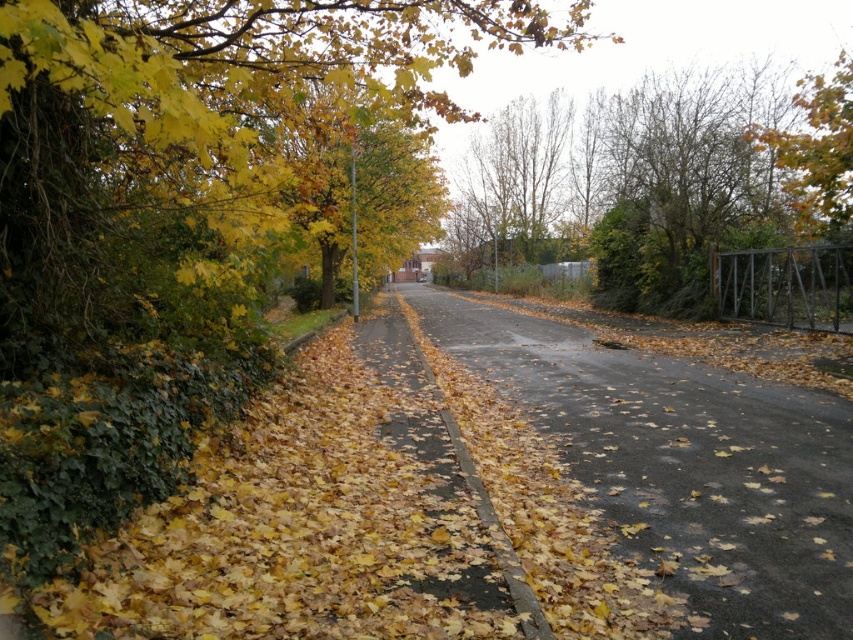
Question: Estimate the real-world distances between objects in this image. Which object is closer to the green leafy tree at upper right?

Choices:
 (A) brown asphalt road at center
 (B) green leafy tree at left

Answer: (B)

Question: Which object is the closest to the green leafy tree at upper right?

Choices:
 (A) brown asphalt road at center
 (B) green leafy tree at left

Answer: (B)

Question: Which point appears closest to the camera in this image?

Choices:
 (A) (685, 202)
 (B) (532, 401)
 (C) (19, 285)

Answer: (C)

Question: Is the position of brown asphalt road at center more distant than that of green leafy tree at upper right?

Choices:
 (A) yes
 (B) no

Answer: (B)

Question: Does brown asphalt road at center appear on the right side of green leafy tree at upper right?

Choices:
 (A) yes
 (B) no

Answer: (B)

Question: Does green leafy tree at left appear under brown asphalt road at center?

Choices:
 (A) yes
 (B) no

Answer: (B)